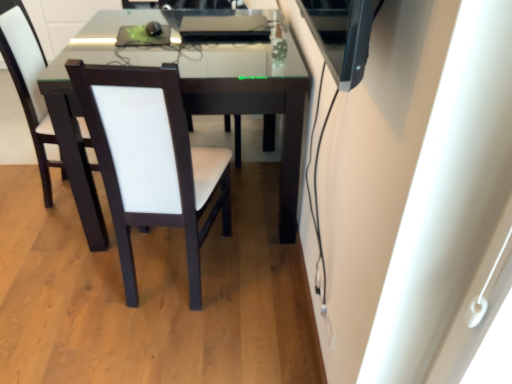
Locate an element on the screen. The height and width of the screenshot is (384, 512). space that is in front of white leather chair at center, which appears as the 1th chair when viewed from the left is located at coordinates [x=53, y=252].